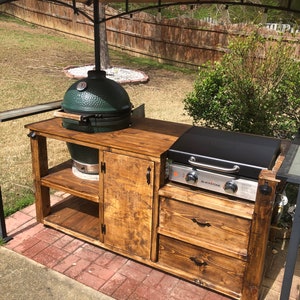
Locate an element on the screen. Image resolution: width=300 pixels, height=300 pixels. knobs is located at coordinates (230, 190), (191, 181).